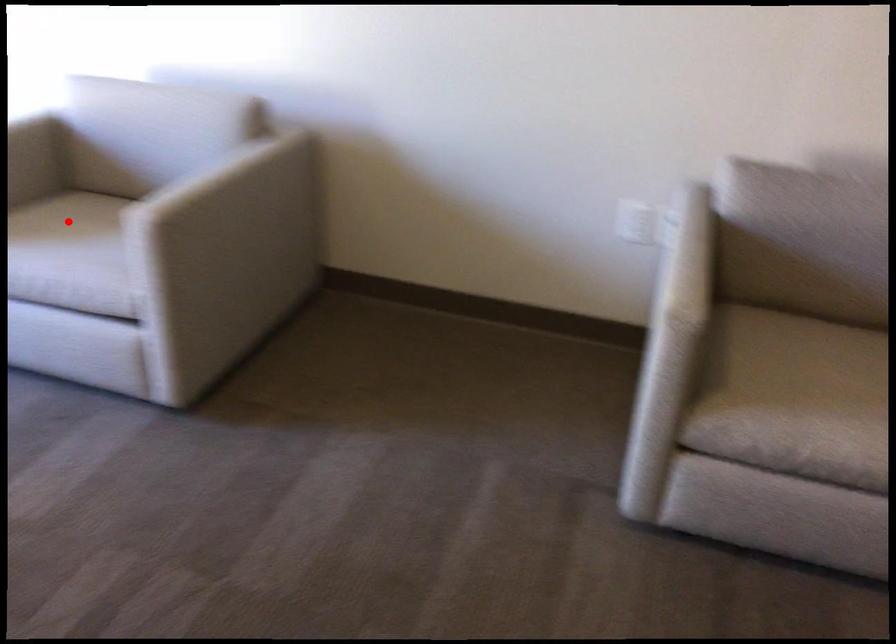
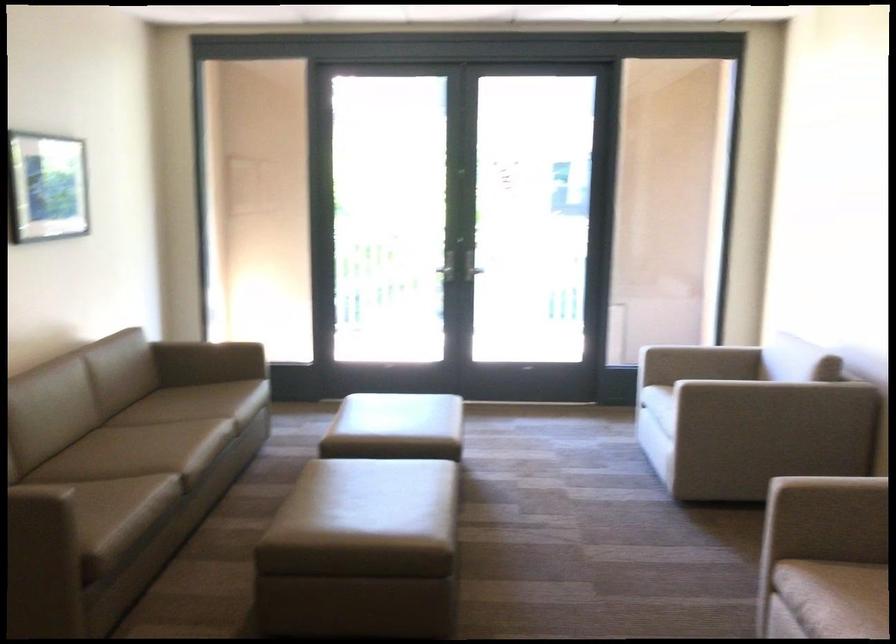
Question: I am providing you with two images of the same scene from different viewpoints. A red point is marked on the first image. Can you still see the location of the red point in image 2?

Choices:
 (A) Yes
 (B) No

Answer: (B)